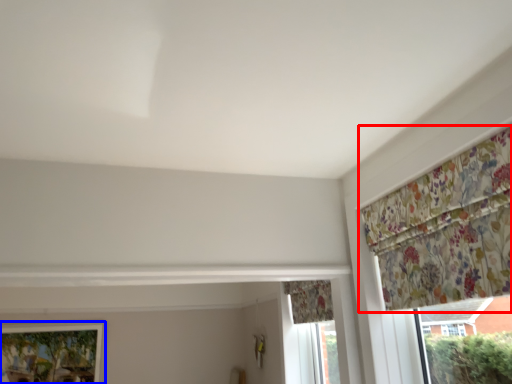
Question: Which object is closer to the camera taking this photo, curtain (highlighted by a red box) or window (highlighted by a blue box)?

Choices:
 (A) curtain
 (B) window

Answer: (A)